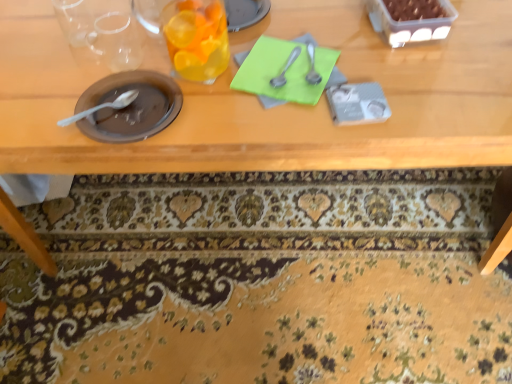
Locate an element on the screen. The width and height of the screenshot is (512, 384). empty space that is to the right of satin silver spoon at center, which is the second tableware from right to left is located at coordinates (375, 66).